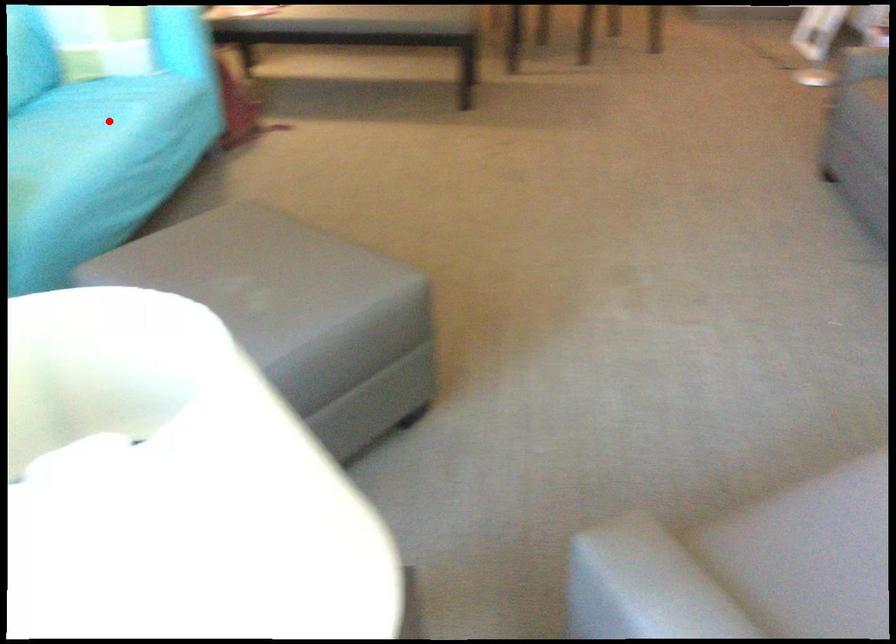
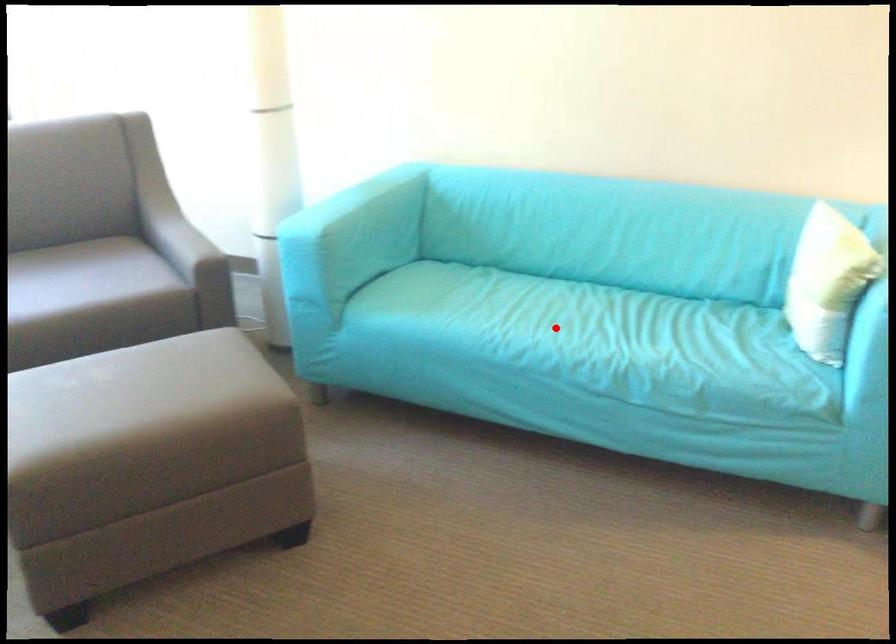
I am providing you with two images of the same scene from different viewpoints. A red point is marked on the first image and another point is marked on the second image. Are the points marked in image1 and image2 representing the same 3D position?

Yes